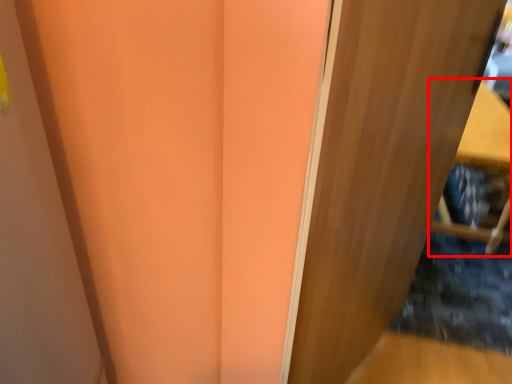
Question: From the image, what is the correct spatial relationship of furniture (annotated by the red box) in relation to door?

Choices:
 (A) right
 (B) left

Answer: (A)